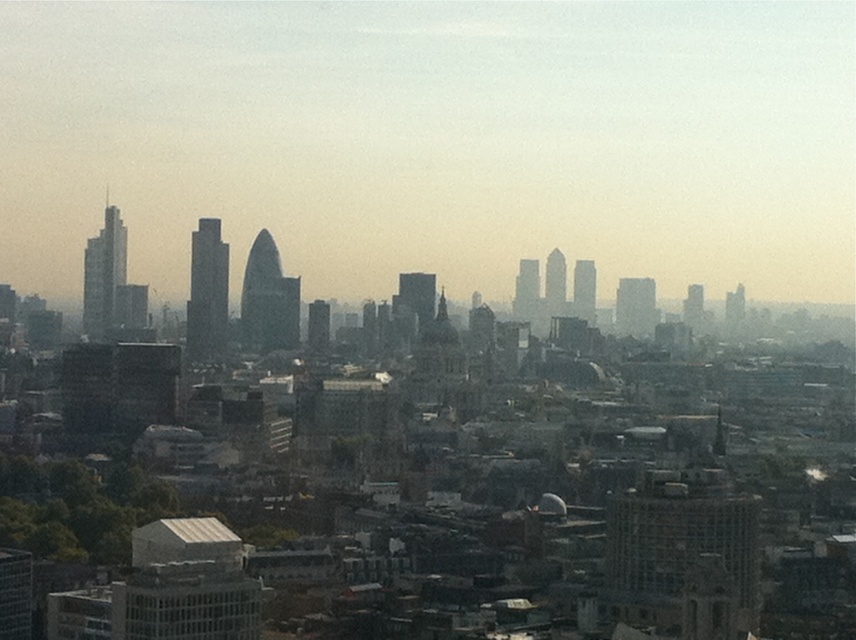
Consider the image. How much distance is there between matte glass skyscrapers at center and glassy gray skyscraper at center?

matte glass skyscrapers at center and glassy gray skyscraper at center are 51.78 meters apart.

Which of these two, matte glass skyscrapers at center or glassy gray skyscraper at center, stands taller?

With more height is matte glass skyscrapers at center.

Image resolution: width=856 pixels, height=640 pixels. Identify the location of matte glass skyscrapers at center. (693, 504).

Locate an element on the screen. This screenshot has height=640, width=856. matte glass skyscrapers at center is located at coordinates (x=693, y=504).